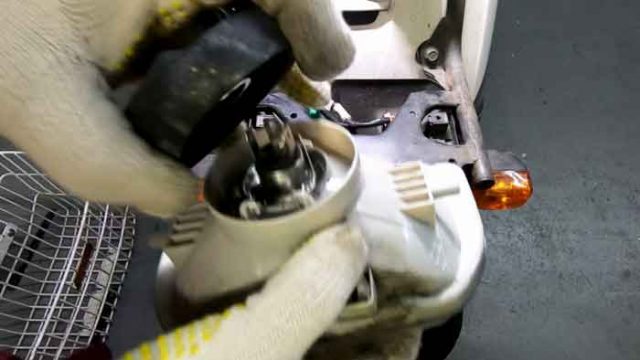
This screenshot has width=640, height=360. I want to click on floor, so click(x=572, y=157).